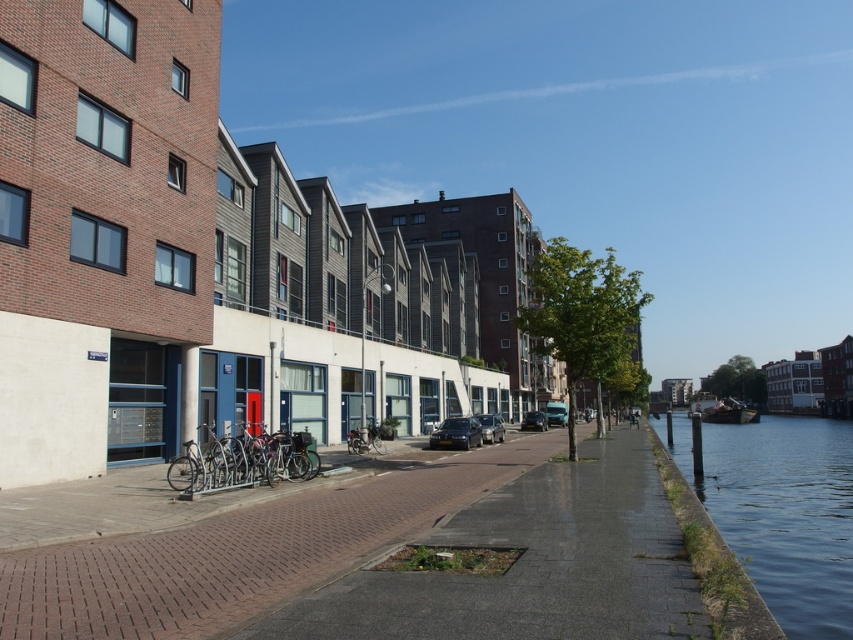
Question: Estimate the real-world distances between objects in this image. Which object is closer to the shiny metallic bicycle at center?

Choices:
 (A) shiny black sedan at center
 (B) brown brick pavement at lower left

Answer: (A)

Question: Which of the following is the closest to the observer?

Choices:
 (A) shiny black car at center
 (B) shiny black sedan at center
 (C) shiny metallic bicycle at center
 (D) clear water at lower right

Answer: (D)

Question: Is clear water at lower right smaller than shiny metallic bicycle at center?

Choices:
 (A) yes
 (B) no

Answer: (B)

Question: Is clear water at lower right positioned in front of shiny black sedan at center?

Choices:
 (A) yes
 (B) no

Answer: (A)

Question: Considering the real-world distances, which object is farthest from the shiny black sedan at center?

Choices:
 (A) shiny black car at center
 (B) clear water at lower right
 (C) brown brick pavement at lower left

Answer: (B)

Question: Is silver metallic bicycle at center to the left of shiny black sedan at center from the viewer's perspective?

Choices:
 (A) yes
 (B) no

Answer: (A)